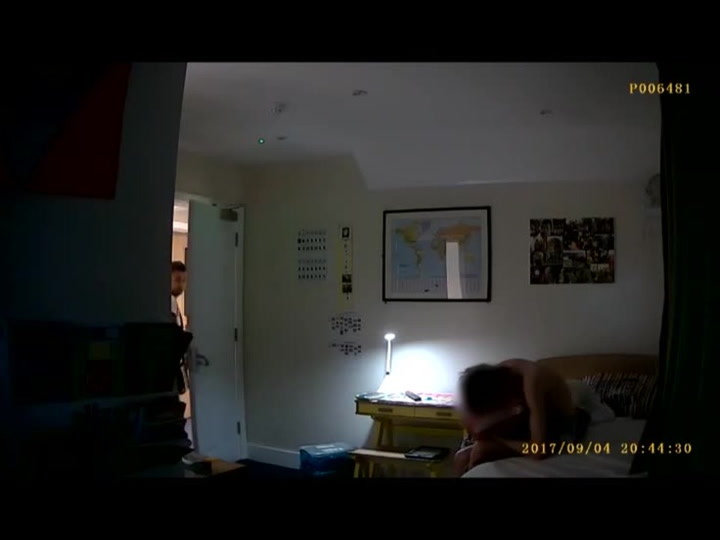
I want to click on doorknob, so click(x=204, y=360).